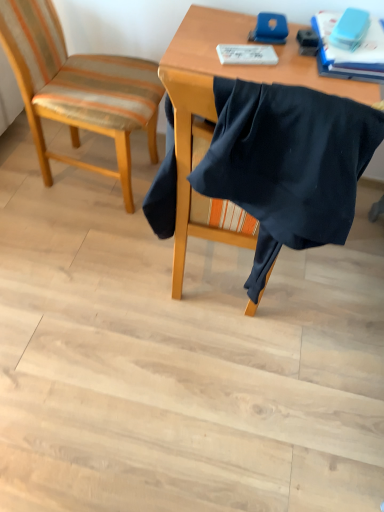
Identify the location of vacant region to the right of white paper at upper center. (309, 71).